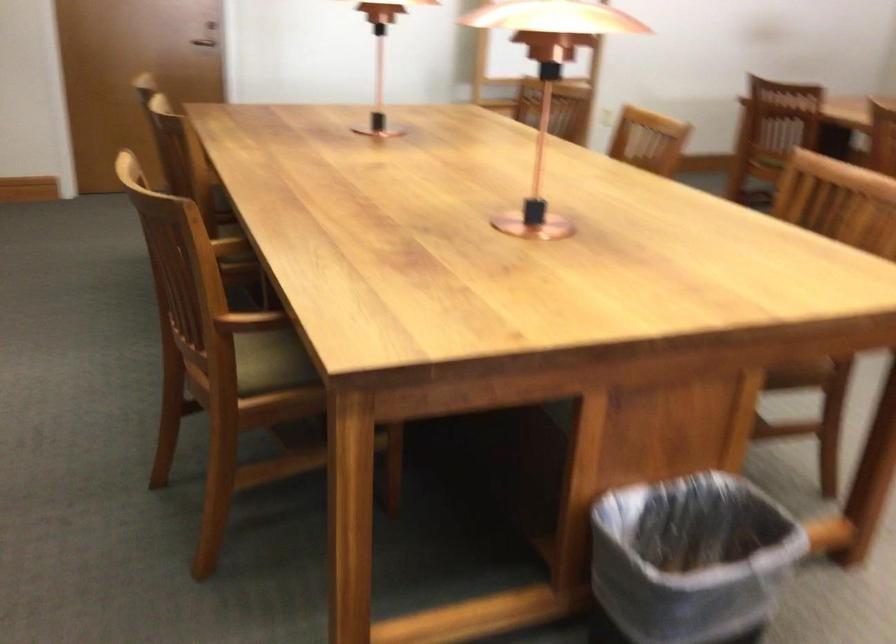
Find where to turn the door handle. Please return your answer as a coordinate pair (x, y).

(202, 42)